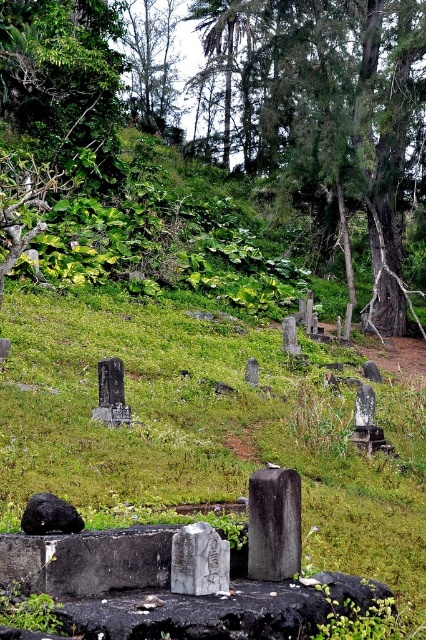
Question: Does black polished stone gravestone at center have a larger size compared to white marble gravestone at center?

Choices:
 (A) yes
 (B) no

Answer: (A)

Question: Which object is closer to the camera taking this photo?

Choices:
 (A) black polished stone gravestone at center
 (B) green grassy at center

Answer: (B)

Question: Does green leafy tree at upper center have a greater width compared to black polished stone gravestone at center?

Choices:
 (A) no
 (B) yes

Answer: (B)

Question: Can you confirm if green leafy tree at upper center is positioned above white marble gravestone at center?

Choices:
 (A) yes
 (B) no

Answer: (A)

Question: Which object appears farthest from the camera in this image?

Choices:
 (A) white marble gravestone at center
 (B) black polished stone gravestone at center

Answer: (B)

Question: Which point is closer to the camera?

Choices:
 (A) green grassy at center
 (B) green leafy tree at upper center

Answer: (A)